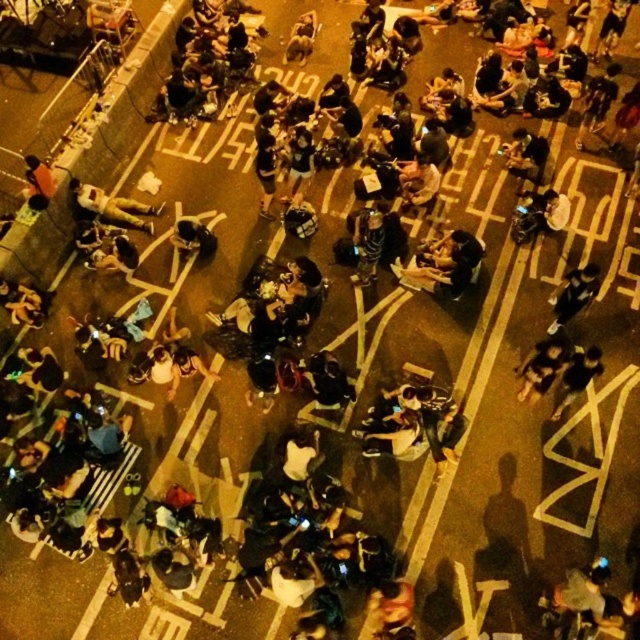
You are a photographer trying to capture a closeup of the dark gray fabric body at lower left and the matte black shirt at lower left. Since you can only focus on one object at a time, which one should you focus on first if you want to ensure both are in focus without moving the camera?

The dark gray fabric body at lower left is below the matte black shirt at lower left, so you should focus on the matte black shirt at lower left first since it is closer to the camera. This will ensure the dark gray fabric body at lower left, which is further away, remains in focus as well.

You are standing at the viewpoint of the image and want to move towards point A located at point (x=141, y=202). However, there is an obstacle at point B located at point (x=52, y=189). Can you walk directly to point A without going around the obstacle at point B?

Point (x=141, y=202) is behind point (x=52, y=189), so you cannot walk directly to point A without going around the obstacle at point B.

You are a photographer standing at the camera position. You want to take a closeup photo of the dark gray fabric body at lower left. Can you reach it without moving from your current position?

The dark gray fabric body at lower left is 15.24 meters from camera, so you cannot reach it without moving closer.